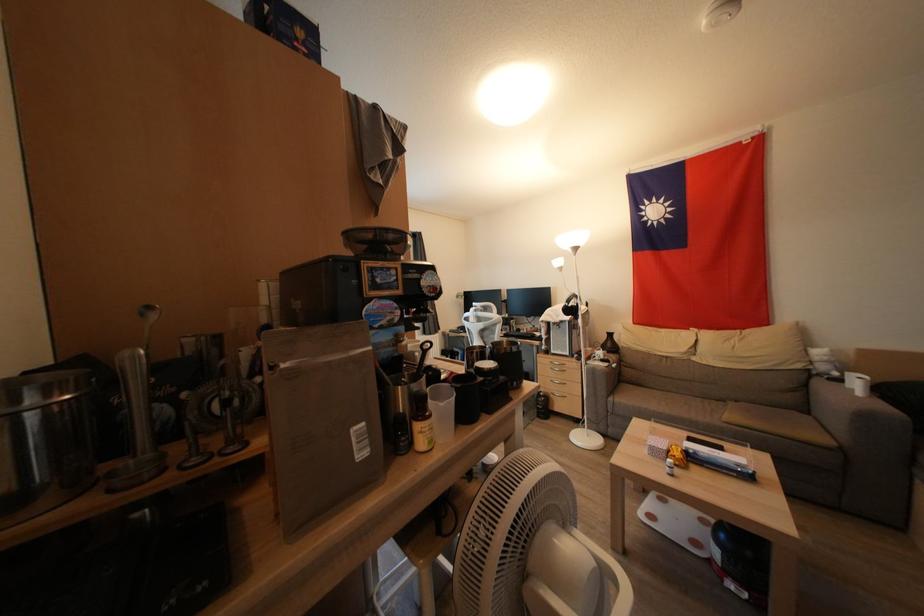
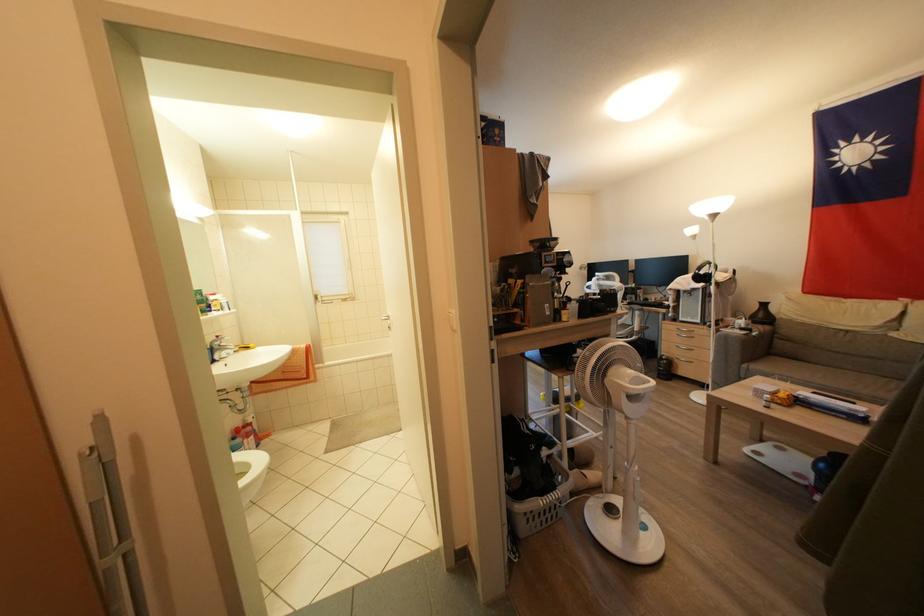
Find the pixel in the second image that matches point 614,349 in the first image.

(766, 320)